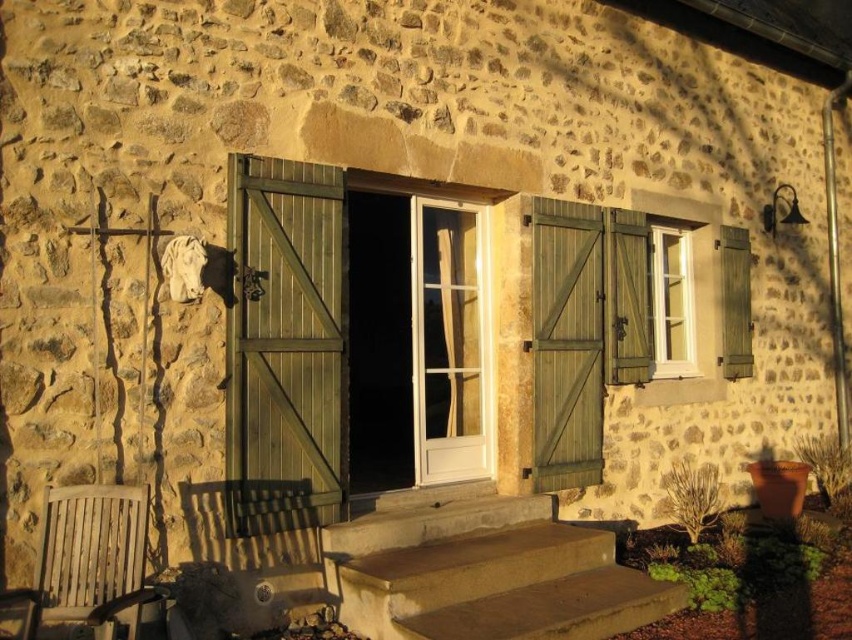
Question: Based on their relative distances, which object is nearer to the white plastic window at upper right?

Choices:
 (A) smooth concrete steps at center
 (B) wooden slats chair at lower left
 (C) green wood door at center
 (D) green wood door at center right

Answer: (D)

Question: Which of the following is the farthest from the observer?

Choices:
 (A) green wood door at center right
 (B) smooth concrete steps at center
 (C) white plastic window at upper right

Answer: (C)

Question: Can you confirm if smooth concrete steps at center is bigger than wooden slats chair at lower left?

Choices:
 (A) yes
 (B) no

Answer: (A)

Question: Is green wood door at center right below white plastic window at upper right?

Choices:
 (A) no
 (B) yes

Answer: (B)

Question: Can you confirm if green wood door at center right is positioned above wooden slats chair at lower left?

Choices:
 (A) yes
 (B) no

Answer: (A)

Question: Among these points, which one is nearest to the camera?

Choices:
 (A) (242, 436)
 (B) (551, 400)
 (C) (658, 259)

Answer: (A)